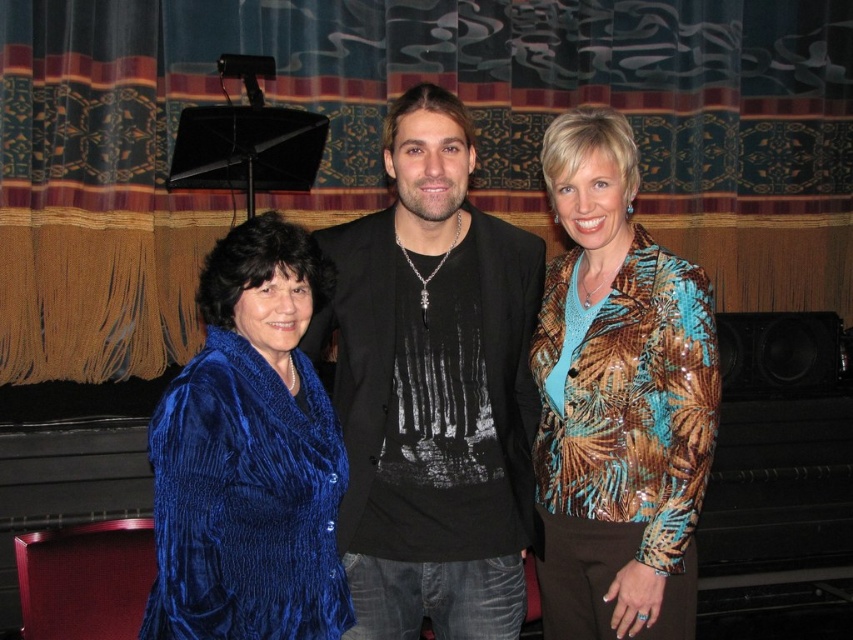
Consider the image. You are a photographer adjusting the lighting for a group photo. You notice the metallic sequined jacket at center and the velvet blue jacket at left. Which jacket will likely reflect more light and require adjustments in your lighting setup?

The metallic sequined jacket at center will likely reflect more light because it is positioned over the velvet blue jacket at left, making it more exposed to the light source.

You are a photographer adjusting the lighting for a stage performance. You need to ensure that the metallic sequined jacket at center is well lit. Given its position at coordinates, can you confirm if it is within the optimal lighting zone which spans from x 0.5 to x 0.7 and y 0.6 to y 0.8?

The metallic sequined jacket at center is positioned at coordinates x 0.627 and y 0.726, which falls within the optimal lighting zone spanning from x 0.5 to x 0.7 and y 0.6 to y 0.8. Therefore, it is well lit.

You are a photographer setting up for a group photo. You have two outfits to consider for the subjects. The velvet blue dress at left is worn by the person on the left, and the metallic sequined jacket at center is worn by the person in the center. Which outfit takes up more visual space in the photo?

The velvet blue dress at left takes up more visual space in the photo because it is bigger than the metallic sequined jacket at center.